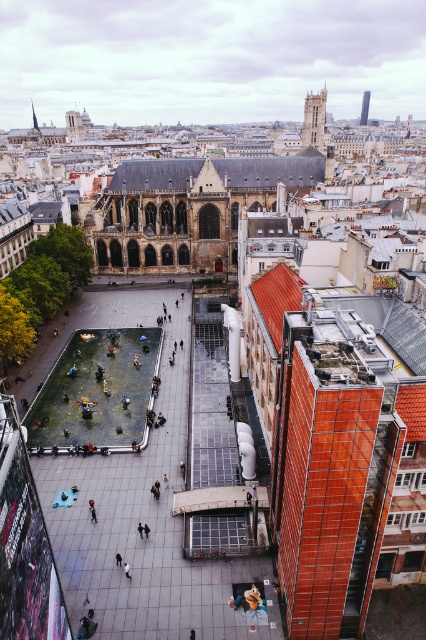
Question: Is gray slate roof at center bigger than smooth glass tower at upper center?

Choices:
 (A) no
 (B) yes

Answer: (B)

Question: Which point appears farthest from the camera in this image?

Choices:
 (A) (367, 90)
 (B) (124, 564)

Answer: (A)

Question: Which of these objects is positioned farthest from the smooth glass tower at upper center?

Choices:
 (A) smooth stone tower at upper center
 (B) gray slate roof at center
 (C) light gray fabric at center
 (D) brown leather jacket at lower center

Answer: (C)

Question: Is brown leather jacket at lower center below light gray fabric at center?

Choices:
 (A) no
 (B) yes

Answer: (B)

Question: Is smooth glass tower at upper center to the right of light gray fabric at center from the viewer's perspective?

Choices:
 (A) no
 (B) yes

Answer: (B)

Question: Which object appears farthest from the camera in this image?

Choices:
 (A) smooth stone tower at upper center
 (B) brown leather jacket at lower center
 (C) gray slate roof at center

Answer: (A)